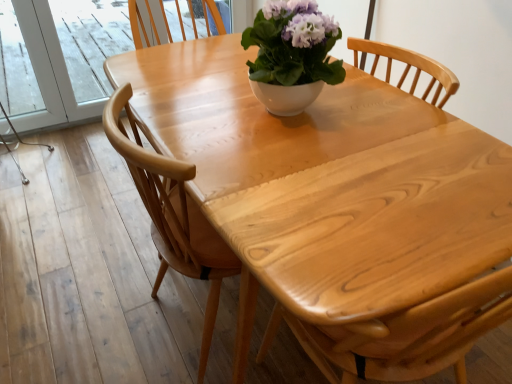
Question: Considering the relative sizes of natural wood table at center and white glossy bowl at center in the image provided, is natural wood table at center bigger than white glossy bowl at center?

Choices:
 (A) yes
 (B) no

Answer: (A)

Question: Would you say natural wood table at center contains white glossy bowl at center?

Choices:
 (A) yes
 (B) no

Answer: (B)

Question: Does natural wood table at center have a lesser height compared to white glossy bowl at center?

Choices:
 (A) no
 (B) yes

Answer: (A)

Question: Considering the relative sizes of natural wood table at center and white glossy bowl at center in the image provided, is natural wood table at center thinner than white glossy bowl at center?

Choices:
 (A) yes
 (B) no

Answer: (B)

Question: Is the depth of natural wood table at center greater than that of white glossy bowl at center?

Choices:
 (A) no
 (B) yes

Answer: (A)

Question: Can you confirm if natural wood table at center is taller than white glossy bowl at center?

Choices:
 (A) yes
 (B) no

Answer: (A)

Question: Is natural wood table at center located outside light wood chair at center?

Choices:
 (A) no
 (B) yes

Answer: (B)

Question: Is natural wood table at center to the left of light wood chair at center from the viewer's perspective?

Choices:
 (A) no
 (B) yes

Answer: (A)

Question: From the image's perspective, is natural wood table at center beneath light wood chair at center?

Choices:
 (A) no
 (B) yes

Answer: (B)

Question: From a real-world perspective, is natural wood table at center physically above light wood chair at center?

Choices:
 (A) yes
 (B) no

Answer: (A)

Question: Are natural wood table at center and light wood chair at center making contact?

Choices:
 (A) no
 (B) yes

Answer: (A)

Question: Can you confirm if natural wood table at center is thinner than light wood chair at center?

Choices:
 (A) yes
 (B) no

Answer: (B)

Question: Is white glossy bowl at center wider than natural wood table at center?

Choices:
 (A) no
 (B) yes

Answer: (A)